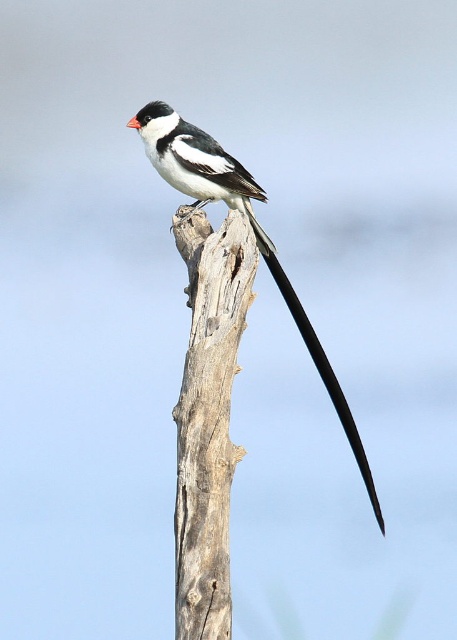
You are a birdwatcher trying to capture a photo of the black glossy tail at upper center and the gray rough wood at center. Which object is taller in the image?

The gray rough wood at center has a greater height compared to the black glossy tail at upper center, so the gray rough wood at center is taller.

You are a photographer trying to capture the white glossy bird at center. You notice the gray rough wood at center in the background. Which object is located to the left of the other?

The gray rough wood at center is positioned on the left side of white glossy bird at center.